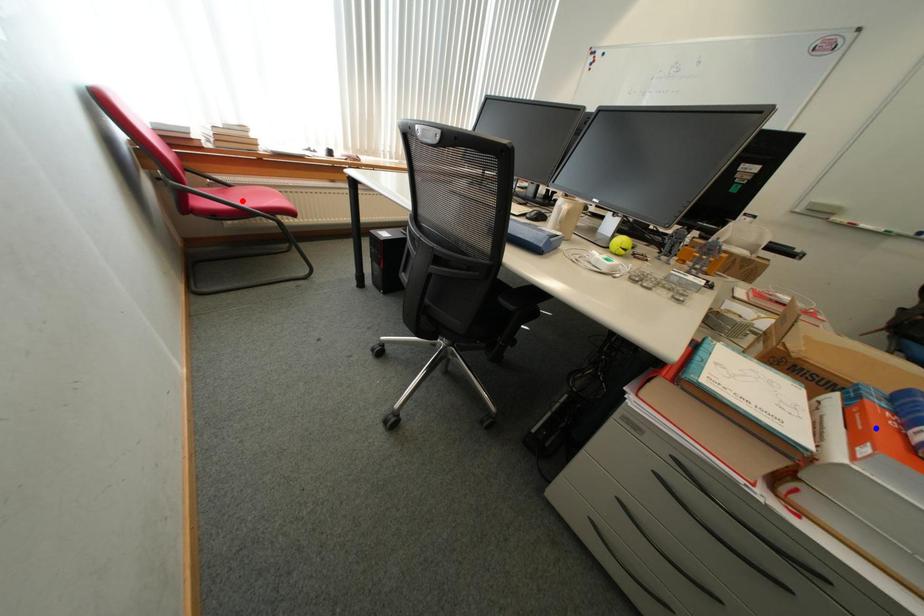
Question: Which of the two points in the image is closer to the camera?

Choices:
 (A) Blue point is closer.
 (B) Red point is closer.

Answer: (A)